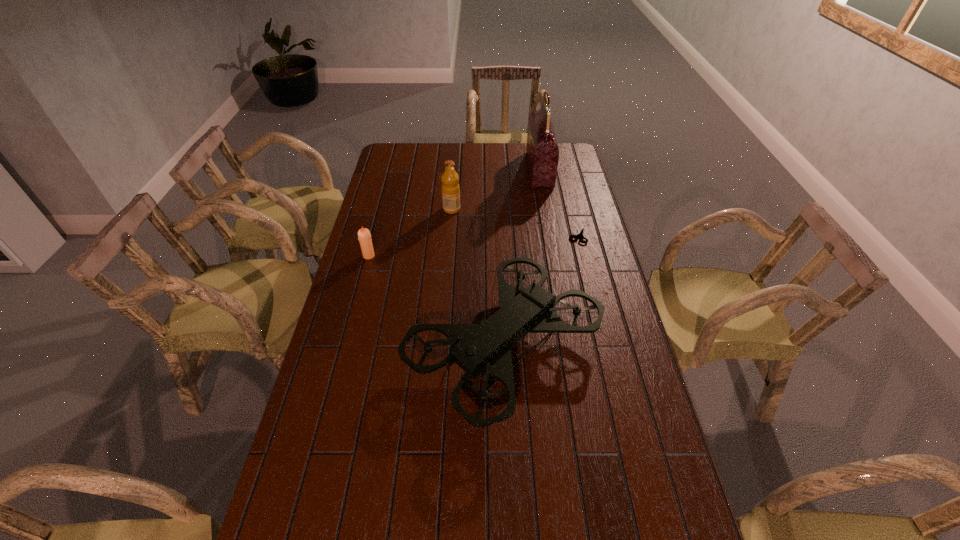
Where is `vacant space situated 0.110m on the front-facing side of the handbag`? vacant space situated 0.110m on the front-facing side of the handbag is located at coordinates (505, 170).

This screenshot has height=540, width=960. What are the coordinates of `free space located on the front-facing side of the handbag` in the screenshot? It's located at (505, 170).

Locate an element on the screen. The width and height of the screenshot is (960, 540). vacant region located on the front-facing side of the handbag is located at coordinates (490, 170).

The width and height of the screenshot is (960, 540). I want to click on free space located 0.120m on the back of the nearest object, so click(500, 254).

The height and width of the screenshot is (540, 960). In order to click on free space located 0.340m on the front label of the third tallest object in this screenshot , I will do `click(542, 209)`.

Where is `vacant space located 0.090m on the front of the leftmost object`? vacant space located 0.090m on the front of the leftmost object is located at coordinates (363, 277).

The image size is (960, 540). Identify the location of vacant space located on the left of the shortest object. (486, 236).

Identify the location of object that is at the far edge. (542, 151).

Find the location of `object present at the left edge`. object present at the left edge is located at coordinates (364, 236).

This screenshot has height=540, width=960. In order to click on handbag located in the right edge section of the desktop in this screenshot , I will do `click(542, 151)`.